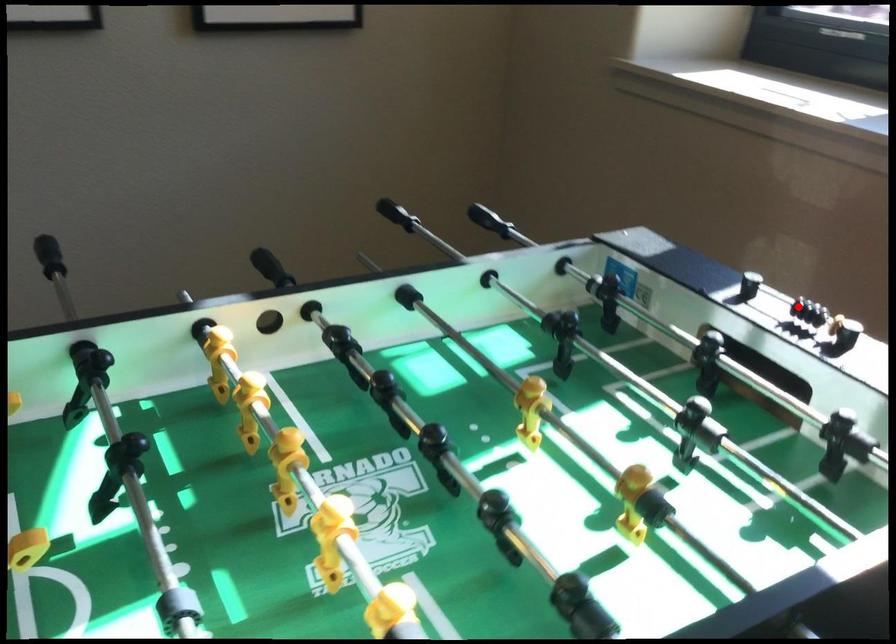
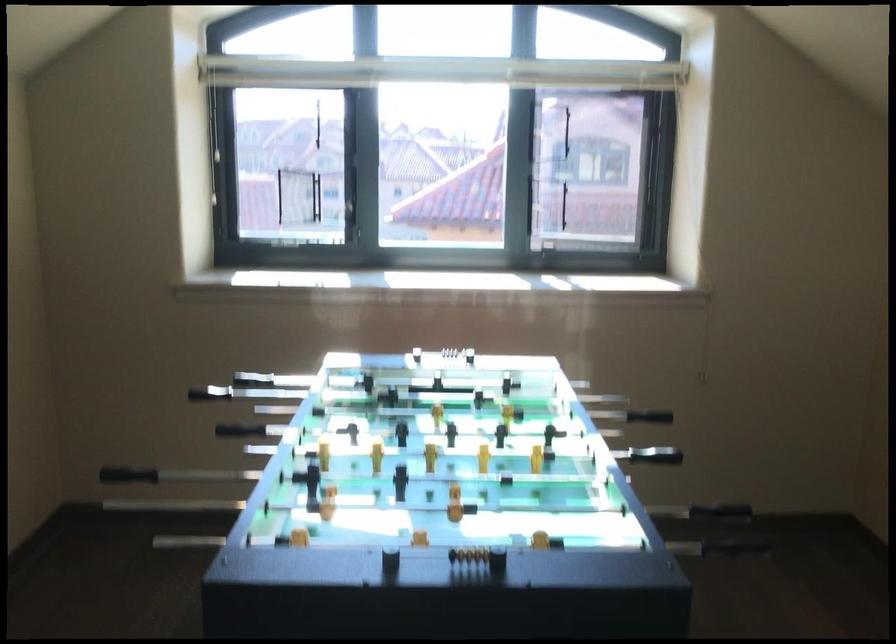
Where in the second image is the point corresponding to the highlighted location from the first image?

(434, 353)